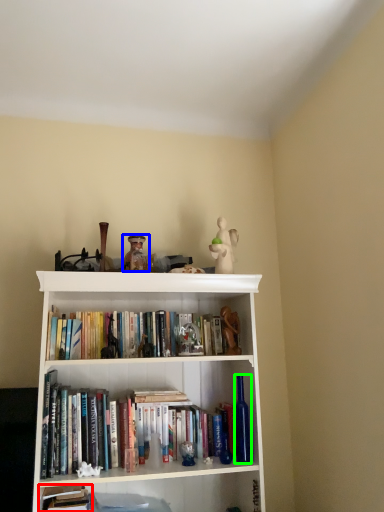
Question: Which is farther away from book (highlighted by a red box)? toy (highlighted by a blue box) or bottle (highlighted by a green box)?

Choices:
 (A) toy
 (B) bottle

Answer: (A)